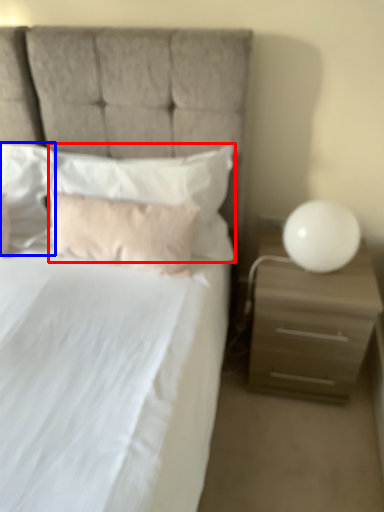
Question: Which point is closer to the camera, pillow (highlighted by a red box) or pillow (highlighted by a blue box)?

Choices:
 (A) pillow
 (B) pillow

Answer: (A)